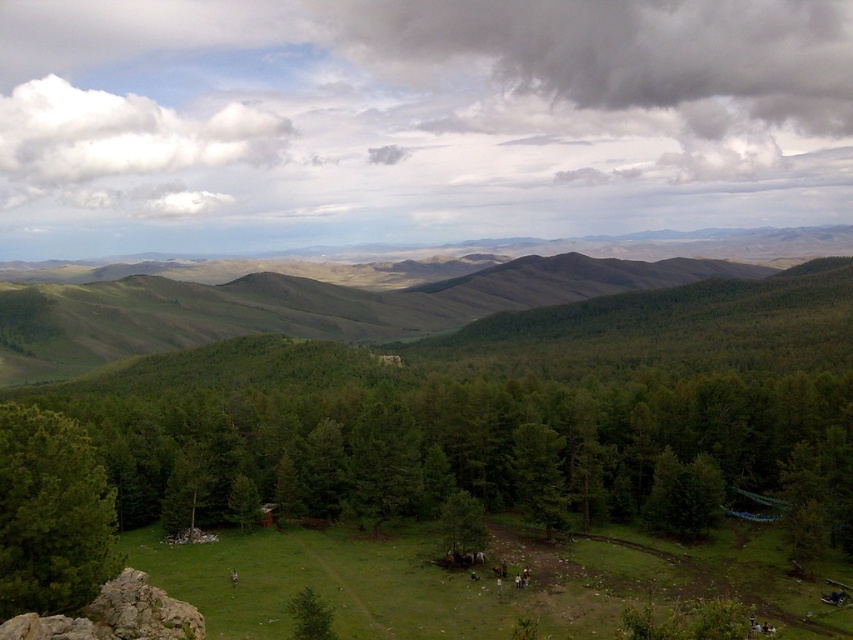
Question: Which of the following is the farthest from the observer?

Choices:
 (A) (529, 483)
 (B) (482, 541)
 (C) (328, 621)
 (D) (456, 600)

Answer: (A)

Question: Is dark gray cloud at upper center bigger than green matte tree at lower center?

Choices:
 (A) yes
 (B) no

Answer: (A)

Question: Observing the image, what is the correct spatial positioning of green matte forest at center in reference to dark gray cloud at upper center?

Choices:
 (A) below
 (B) above

Answer: (A)

Question: Which is farther from the dark gray cloud at upper center?

Choices:
 (A) green matte forest at center
 (B) green matte tree at lower left
 (C) cloudy sky at upper center
 (D) green matte tree at lower center

Answer: (D)

Question: Considering the real-world distances, which object is farthest from the green matte tree at center?

Choices:
 (A) dark gray cloud at upper center
 (B) green matte tree at lower center
 (C) green matte tree at lower left
 (D) green grassy field at lower center

Answer: (A)

Question: Considering the relative positions of green matte forest at center and dark gray cloud at upper center in the image provided, where is green matte forest at center located with respect to dark gray cloud at upper center?

Choices:
 (A) left
 (B) right

Answer: (A)